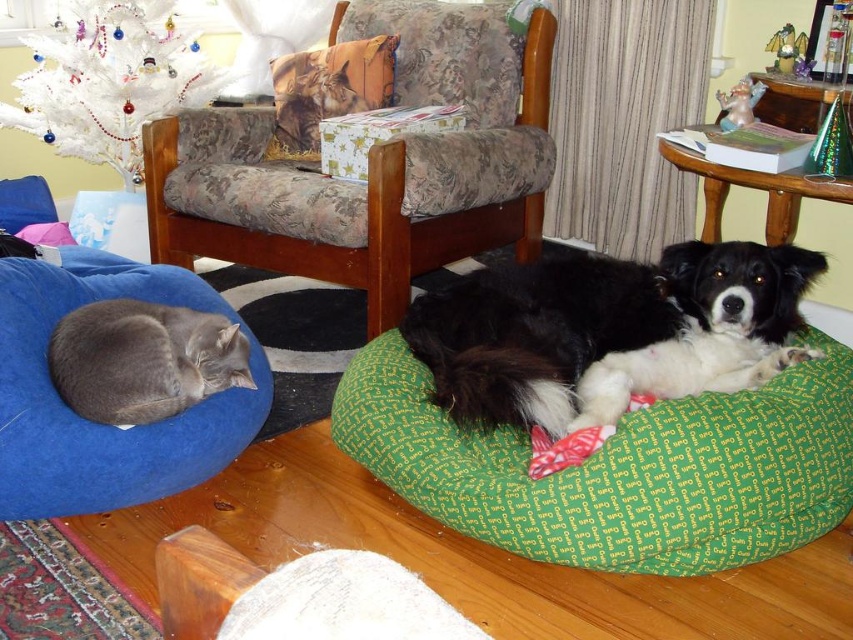
Looking at this image, who is lower down, velvet floral-patterned bean bag chair at center or gray plush cat at left?

gray plush cat at left

Who is higher up, velvet floral-patterned bean bag chair at center or gray plush cat at left?

Positioned higher is velvet floral-patterned bean bag chair at center.

You are a GUI agent. You are given a task and a screenshot of the screen. Output one action in this format:
    pyautogui.click(x=<x>, y=<y>)
    Task: Click on the velvet floral-patterned bean bag chair at center
    The width and height of the screenshot is (853, 640).
    Given the screenshot: What is the action you would take?
    pyautogui.click(x=370, y=164)

Which is more to the left, black soft dog at center or printed fabric pillow at upper center?

printed fabric pillow at upper center

Does black soft dog at center appear over printed fabric pillow at upper center?

Actually, black soft dog at center is below printed fabric pillow at upper center.

Is point (558, 323) positioned before point (332, 52)?

Yes, it is.

Find the location of a particular element. black soft dog at center is located at coordinates (608, 330).

Is velvet floral-patterned bean bag chair at center above printed fabric pillow at upper center?

Incorrect, velvet floral-patterned bean bag chair at center is not positioned above printed fabric pillow at upper center.

Can you confirm if velvet floral-patterned bean bag chair at center is smaller than printed fabric pillow at upper center?

Incorrect, velvet floral-patterned bean bag chair at center is not smaller in size than printed fabric pillow at upper center.

Which is in front, point (424, 195) or point (381, 104)?

Point (424, 195)

Locate an element on the screen. The height and width of the screenshot is (640, 853). velvet floral-patterned bean bag chair at center is located at coordinates (370, 164).